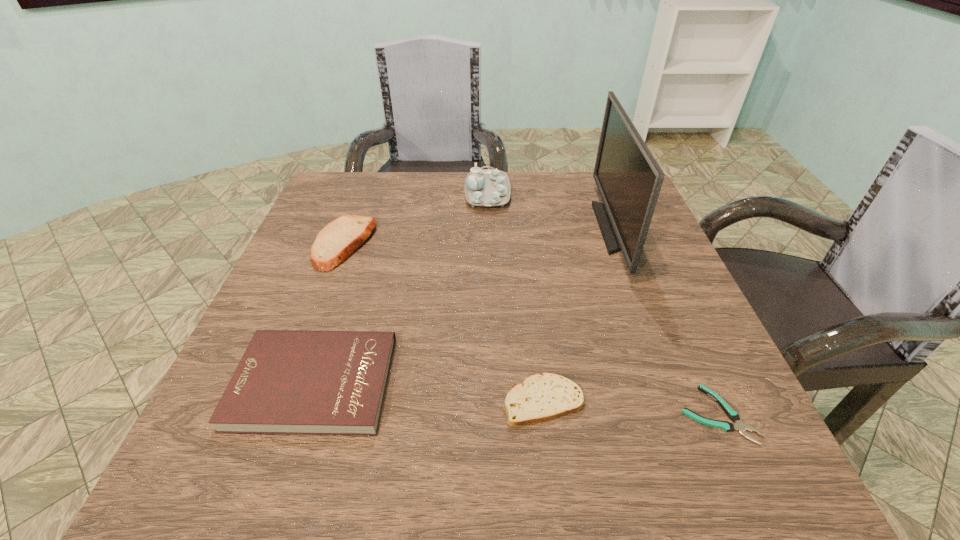
Where is `vacant point at the left edge`? The height and width of the screenshot is (540, 960). vacant point at the left edge is located at coordinates (292, 282).

In the image, there is a desktop. At what (x,y) coordinates should I click in order to perform the action: click on vacant space at the right edge. Please return your answer as a coordinate pair (x, y). The height and width of the screenshot is (540, 960). Looking at the image, I should click on (679, 346).

The image size is (960, 540). In order to click on vacant position at the far left corner of the desktop in this screenshot , I will do `click(367, 191)`.

Image resolution: width=960 pixels, height=540 pixels. In order to click on vacant point at the near left corner in this screenshot , I will do `click(279, 469)`.

Where is `vacant space at the far right corner of the desktop`? The width and height of the screenshot is (960, 540). vacant space at the far right corner of the desktop is located at coordinates (593, 181).

Image resolution: width=960 pixels, height=540 pixels. I want to click on vacant space at the near right corner of the desktop, so click(x=717, y=497).

Identify the location of vacant space that is in between the monitor and the right pita bread. (580, 315).

Identify the location of free space between the third shortest object and the taller pita bread. (329, 313).

At what (x,y) coordinates should I click in order to perform the action: click on vacant region between the monitor and the third shortest object. Please return your answer as a coordinate pair (x, y). This screenshot has height=540, width=960. Looking at the image, I should click on (466, 306).

What are the coordinates of `free area in between the tallest object and the left pita bread` in the screenshot? It's located at (480, 236).